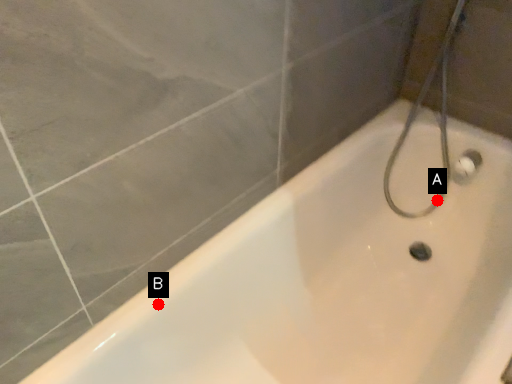
Question: Two points are circled on the image, labeled by A and B beside each circle. Which point is farther from the camera taking this photo?

Choices:
 (A) A is further
 (B) B is further

Answer: (A)